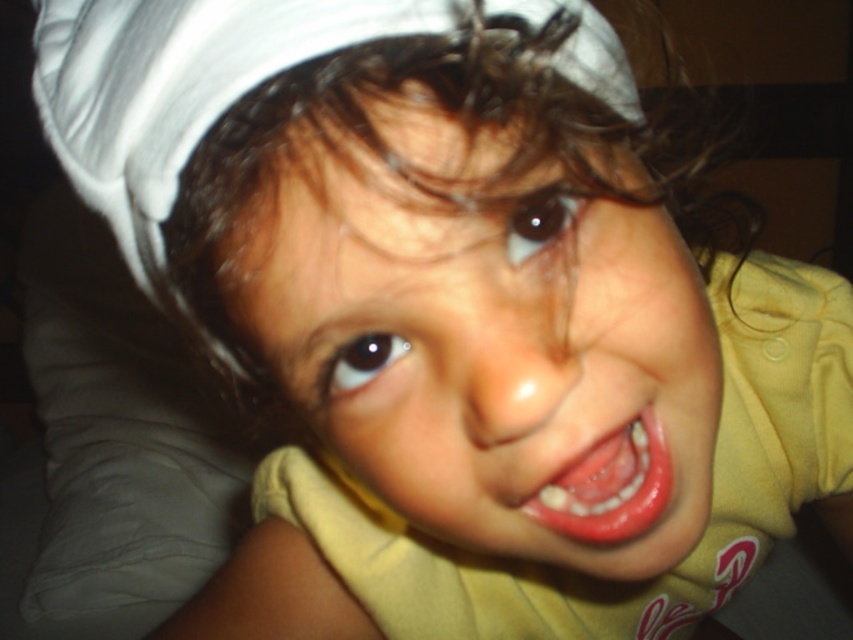
Does smooth skin face at center have a greater width compared to smooth pink lips at center?

Yes, smooth skin face at center is wider than smooth pink lips at center.

The image size is (853, 640). I want to click on smooth skin face at center, so coord(486,340).